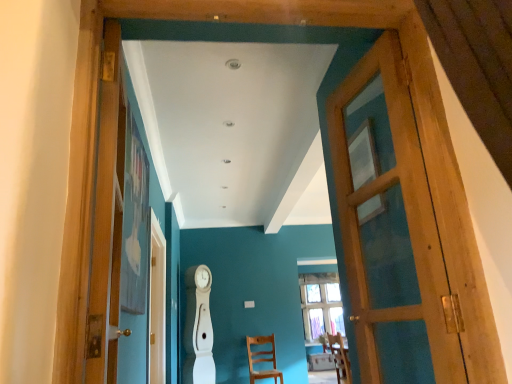
Question: Would you say wooden chair at center, the second chair from the front, is to the left or to the right of wooden door at right, which is counted as the first door, starting from the right, in the picture?

Choices:
 (A) right
 (B) left

Answer: (B)

Question: From a real-world perspective, is wooden chair at center, which is counted as the 1th chair, starting from the bottom, above or below wooden door at right, acting as the second door starting from the left?

Choices:
 (A) above
 (B) below

Answer: (B)

Question: Estimate the real-world distances between objects in this image. Which object is closer to the wooden door at right, which is counted as the first door, starting from the right?

Choices:
 (A) wooden chair at center, the 2th chair viewed from the top
 (B) wooden chair at center, which appears as the first chair when viewed from the front
 (C) wooden door at left, the second door positioned from the right

Answer: (C)

Question: Which of these objects is positioned farthest from the wooden chair at center, which is counted as the 1th chair, starting from the bottom?

Choices:
 (A) wooden door at right, acting as the second door starting from the left
 (B) wooden chair at center, acting as the 2th chair starting from the bottom
 (C) wooden door at left, the second door positioned from the right

Answer: (C)